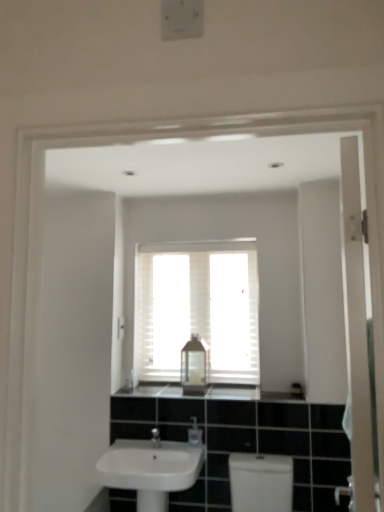
This screenshot has width=384, height=512. I want to click on vacant space situated on the left part of transparent plastic bottle at center, so click(x=161, y=388).